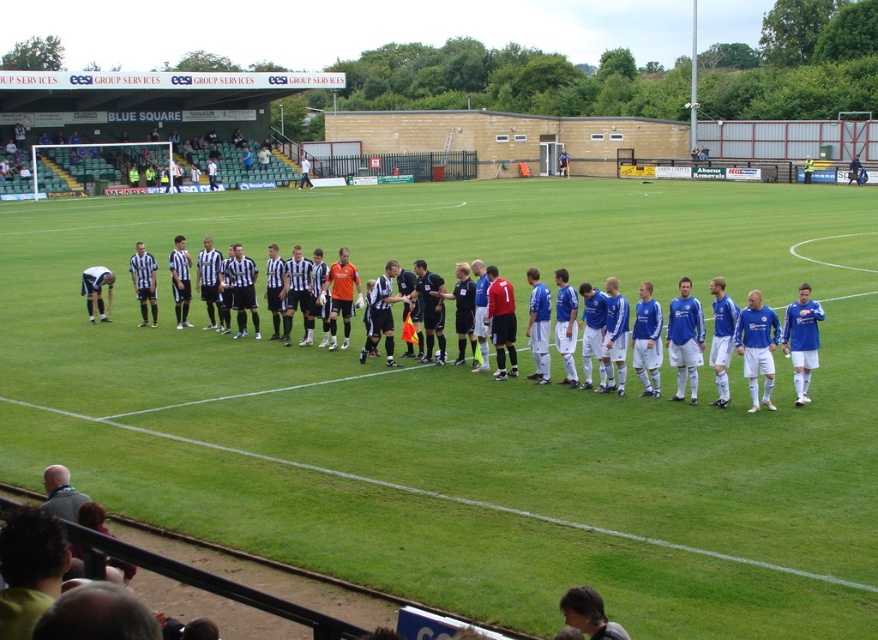
Question: Is green grass field at center bigger than striped jersey at center?

Choices:
 (A) no
 (B) yes

Answer: (B)

Question: Which point is closer to the camera?

Choices:
 (A) (141, 262)
 (B) (252, 474)
 (C) (592, 636)
 (D) (106, 268)

Answer: (C)

Question: Does green grass field at center come behind blue/white jersey at center?

Choices:
 (A) yes
 (B) no

Answer: (B)

Question: Which object appears farthest from the camera in this image?

Choices:
 (A) green grass field at center
 (B) blue/white jersey at center
 (C) smooth brown hair at lower center
 (D) striped jersey at center

Answer: (D)

Question: Which point is closer to the camera?

Choices:
 (A) (141, 250)
 (B) (602, 634)
 (C) (55, 490)
 (D) (91, 308)

Answer: (B)

Question: Is blue/white jersey at center positioned behind matte black shorts at left?

Choices:
 (A) yes
 (B) no

Answer: (B)